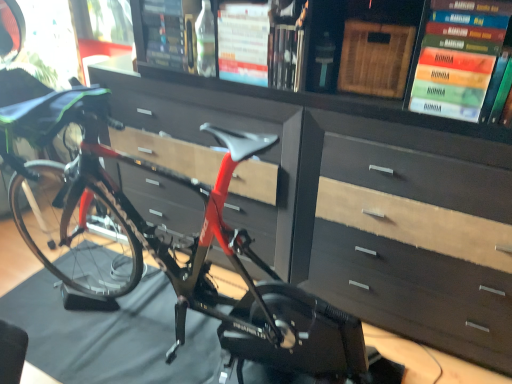
Question: Should I look upward or downward to see hardcover book at upper center, the 1th book viewed from the left?

Choices:
 (A) up
 (B) down

Answer: (A)

Question: From the image's perspective, is clear glass bottle at center beneath hardcover book at center, the second book from the left?

Choices:
 (A) yes
 (B) no

Answer: (B)

Question: Can you confirm if clear glass bottle at center is taller than hardcover book at center, which ranks as the fourth book in right-to-left order?

Choices:
 (A) no
 (B) yes

Answer: (A)

Question: From a real-world perspective, is clear glass bottle at center physically above hardcover book at center, the second book from the left?

Choices:
 (A) yes
 (B) no

Answer: (B)

Question: Is clear glass bottle at center shorter than hardcover book at center, which ranks as the fourth book in right-to-left order?

Choices:
 (A) no
 (B) yes

Answer: (B)

Question: From the image's perspective, is clear glass bottle at center over hardcover book at center, which ranks as the fourth book in right-to-left order?

Choices:
 (A) no
 (B) yes

Answer: (B)

Question: Does clear glass bottle at center have a greater width compared to hardcover book at center, which ranks as the fourth book in right-to-left order?

Choices:
 (A) no
 (B) yes

Answer: (A)

Question: Considering the relative sizes of hardcover book at upper center, which appears as the third book when viewed from the right, and shiny red bike at center in the image provided, is hardcover book at upper center, which appears as the third book when viewed from the right, bigger than shiny red bike at center?

Choices:
 (A) no
 (B) yes

Answer: (A)

Question: From the image's perspective, is hardcover book at upper center, the 3th book when ordered from left to right, above shiny red bike at center?

Choices:
 (A) no
 (B) yes

Answer: (B)

Question: Could you tell me if hardcover book at upper center, the 3th book when ordered from left to right, is turned towards shiny red bike at center?

Choices:
 (A) no
 (B) yes

Answer: (A)

Question: Is the position of hardcover book at upper center, the 3th book when ordered from left to right, less distant than that of shiny red bike at center?

Choices:
 (A) yes
 (B) no

Answer: (B)

Question: Is hardcover book at upper center, the 3th book when ordered from left to right, oriented away from shiny red bike at center?

Choices:
 (A) no
 (B) yes

Answer: (A)

Question: Is hardcover book at upper center, the 3th book when ordered from left to right, at the right side of shiny red bike at center?

Choices:
 (A) yes
 (B) no

Answer: (B)

Question: Considering the relative positions of hardcover book at upper center, positioned as the 5th book in right-to-left order, and hardcover book at upper center, the 3th book when ordered from left to right, in the image provided, is hardcover book at upper center, positioned as the 5th book in right-to-left order, behind hardcover book at upper center, the 3th book when ordered from left to right,?

Choices:
 (A) no
 (B) yes

Answer: (B)